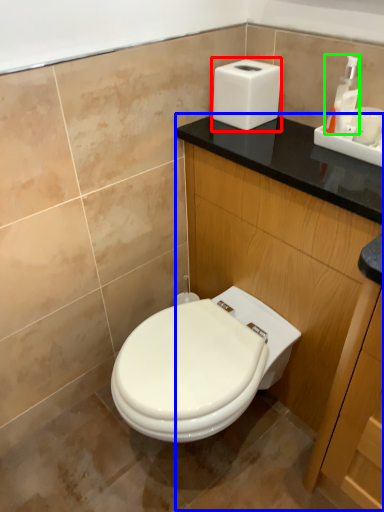
Question: Which object is the closest to the hand dryer (highlighted by a red box)? Choose among these: dresser (highlighted by a blue box) or soap dispenser (highlighted by a green box).

Choices:
 (A) dresser
 (B) soap dispenser

Answer: (B)